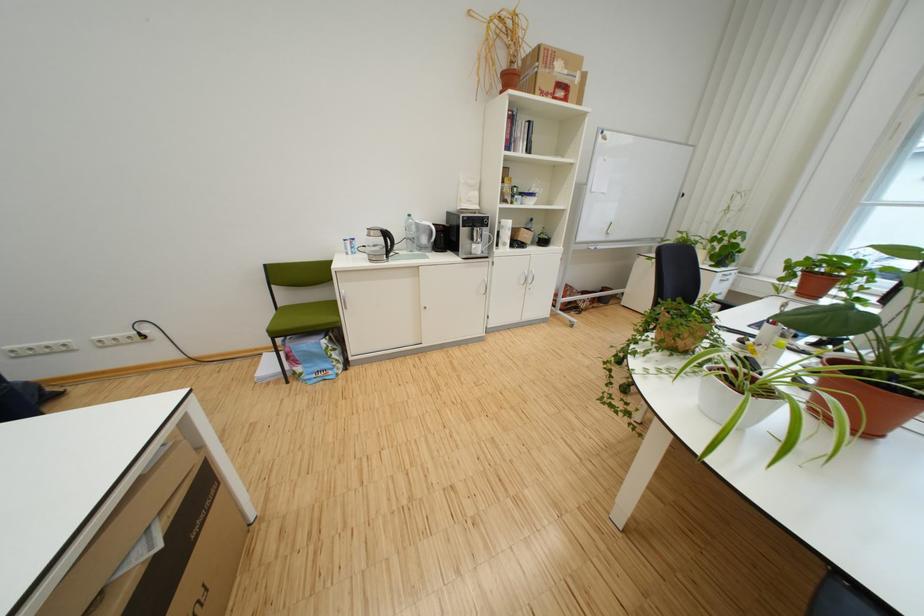
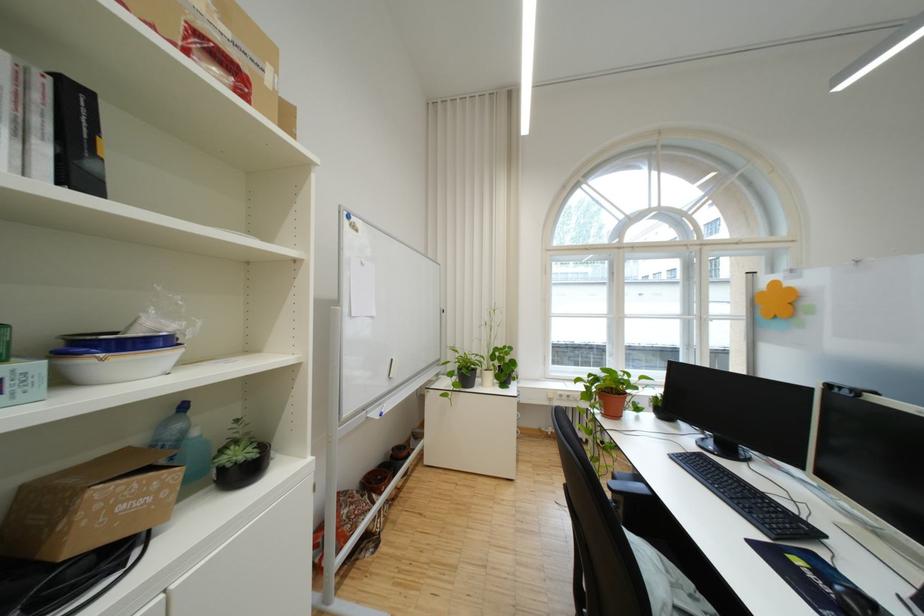
The point at [540,225] is marked in the first image. Where is the corresponding point in the second image?

(176, 426)